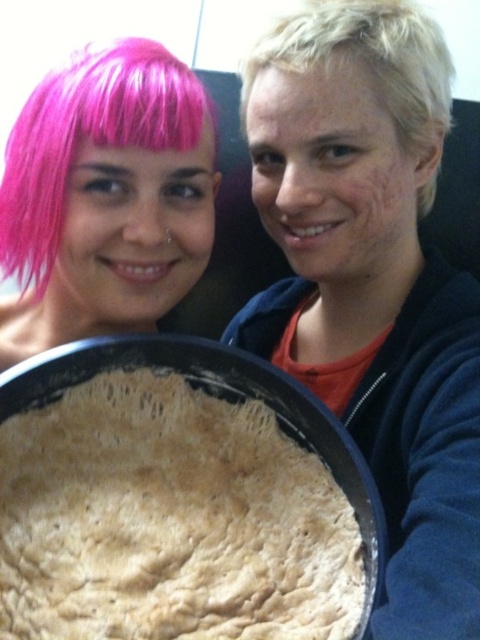
Question: Which of the following is the closest to the observer?

Choices:
 (A) (397, 61)
 (B) (36, 177)
 (C) (350, 70)

Answer: (C)

Question: Can you confirm if brown crumbly dough at center is positioned to the left of blondehair at right?

Choices:
 (A) no
 (B) yes

Answer: (B)

Question: Which of the following is the farthest from the observer?

Choices:
 (A) (35, 474)
 (B) (311, 48)
 (C) (165, 147)
 (D) (257, 90)

Answer: (C)

Question: Is baked dough at center thinner than pink matte wig at upper left?

Choices:
 (A) no
 (B) yes

Answer: (A)

Question: In this image, where is baked dough at center located relative to pink matte wig at upper left?

Choices:
 (A) above
 (B) below

Answer: (B)

Question: Which point is farther to the camera?

Choices:
 (A) pink matte wig at upper left
 (B) baked dough at center

Answer: (A)